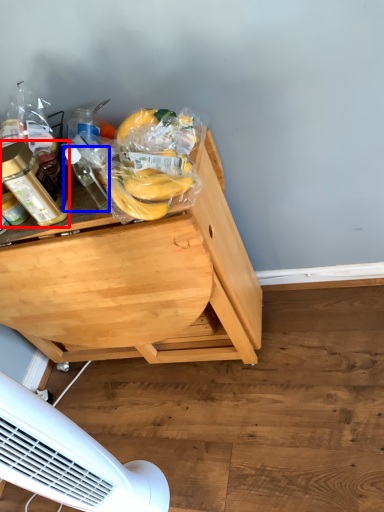
Question: Which object appears farthest to the camera in this image, bottle (highlighted by a red box) or bottle (highlighted by a blue box)?

Choices:
 (A) bottle
 (B) bottle

Answer: (A)